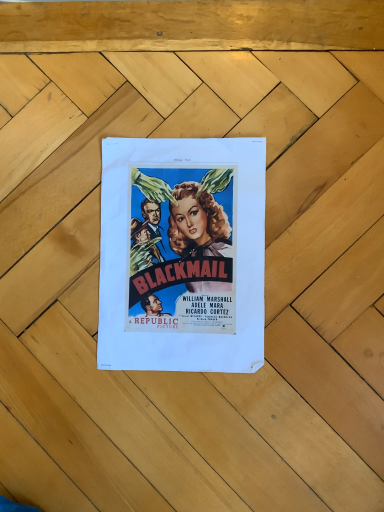
Looking at this image, in order to face matte paper poster at center, should I rotate leftwards or rightwards?

Turn left approximately 3.300 degrees to face it.

Locate an element on the screen. matte paper poster at center is located at coordinates (182, 255).

What do you see at coordinates (182, 255) in the screenshot? This screenshot has width=384, height=512. I see `matte paper poster at center` at bounding box center [182, 255].

This screenshot has height=512, width=384. Find the location of `matte paper poster at center`. matte paper poster at center is located at coordinates (182, 255).